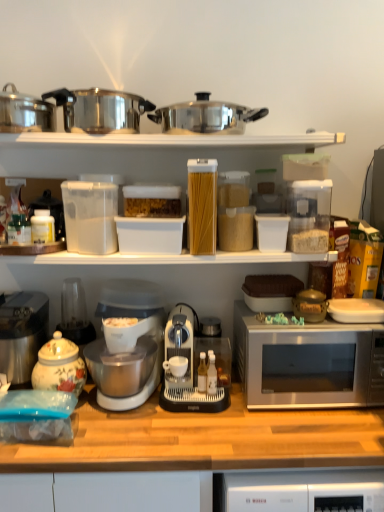
Question: Is stainless steel coffee maker at left next to white plastic coffee machine at center?

Choices:
 (A) yes
 (B) no

Answer: (B)

Question: Considering the relative sizes of stainless steel coffee maker at left and white plastic coffee machine at center in the image provided, is stainless steel coffee maker at left wider than white plastic coffee machine at center?

Choices:
 (A) no
 (B) yes

Answer: (A)

Question: Is the position of stainless steel coffee maker at left more distant than that of white plastic coffee machine at center?

Choices:
 (A) no
 (B) yes

Answer: (B)

Question: Can you confirm if stainless steel coffee maker at left is smaller than white plastic coffee machine at center?

Choices:
 (A) yes
 (B) no

Answer: (A)

Question: From the image's perspective, is stainless steel coffee maker at left over white plastic coffee machine at center?

Choices:
 (A) yes
 (B) no

Answer: (A)

Question: Considering the positions of white plastic coffee machine at center and white plastic mixer at center in the image, is white plastic coffee machine at center wider or thinner than white plastic mixer at center?

Choices:
 (A) wide
 (B) thin

Answer: (B)

Question: In the image, is white plastic coffee machine at center positioned in front of or behind white plastic mixer at center?

Choices:
 (A) behind
 (B) front

Answer: (A)

Question: Does point (172, 394) appear closer or farther from the camera than point (142, 301)?

Choices:
 (A) closer
 (B) farther

Answer: (A)

Question: Is white plastic coffee machine at center spatially inside white plastic mixer at center, or outside of it?

Choices:
 (A) inside
 (B) outside

Answer: (B)

Question: In terms of size, does stainless steel pot at upper left appear bigger or smaller than polished stainless steel pot at upper center, the 2th crock pot when ordered from left to right?

Choices:
 (A) small
 (B) big

Answer: (A)

Question: From the image's perspective, relative to polished stainless steel pot at upper center, positioned as the 1th crock pot in right-to-left order, is stainless steel pot at upper left above or below?

Choices:
 (A) below
 (B) above

Answer: (A)

Question: From a real-world perspective, is stainless steel pot at upper left physically located above or below polished stainless steel pot at upper center, positioned as the 1th crock pot in right-to-left order?

Choices:
 (A) above
 (B) below

Answer: (B)

Question: Is stainless steel pot at upper left wider or thinner than polished stainless steel pot at upper center, the 2th crock pot when ordered from left to right?

Choices:
 (A) thin
 (B) wide

Answer: (B)

Question: From a real-world perspective, is white plastic containers at upper center physically located above or below wooden at lower center?

Choices:
 (A) above
 (B) below

Answer: (A)

Question: Based on their sizes in the image, would you say white plastic containers at upper center is bigger or smaller than wooden at lower center?

Choices:
 (A) big
 (B) small

Answer: (B)